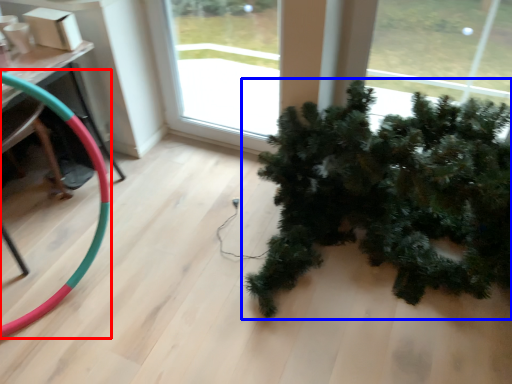
Question: Which point is closer to the camera, garden hose (highlighted by a red box) or houseplant (highlighted by a blue box)?

Choices:
 (A) garden hose
 (B) houseplant

Answer: (B)